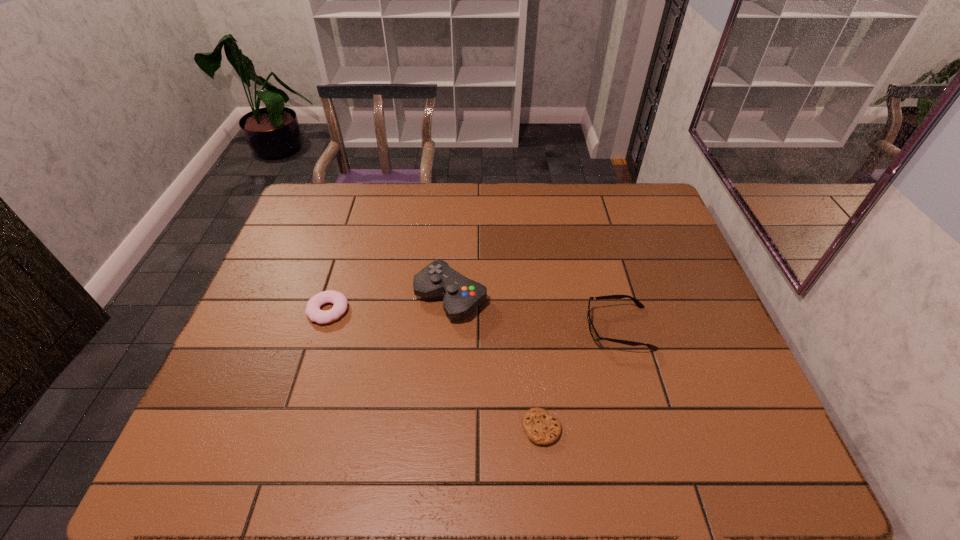
Where is `vacant area situated 0.220m on the front-facing side of the spectacles`? The width and height of the screenshot is (960, 540). vacant area situated 0.220m on the front-facing side of the spectacles is located at coordinates (502, 328).

In order to click on free location located on the front-facing side of the spectacles in this screenshot , I will do `click(464, 328)`.

Identify the location of blank space located on the front of the doughnut. (284, 451).

At what (x,y) coordinates should I click in order to perform the action: click on free space located 0.220m on the right of the second object from right to left. Please return your answer as a coordinate pair (x, y). This screenshot has height=540, width=960. Looking at the image, I should click on (661, 428).

You are a GUI agent. You are given a task and a screenshot of the screen. Output one action in this format:
    pyautogui.click(x=<x>, y=<y>)
    Task: Click on the object located at the near edge
    
    Given the screenshot: What is the action you would take?
    pyautogui.click(x=542, y=429)

The width and height of the screenshot is (960, 540). Identify the location of object that is positioned at the left edge. (340, 302).

Identify the location of free space at the far edge of the desktop. Image resolution: width=960 pixels, height=540 pixels. (391, 221).

In the image, there is a desktop. Find the location of `vacant space at the near edge`. vacant space at the near edge is located at coordinates (509, 448).

The image size is (960, 540). In the image, there is a desktop. What are the coordinates of `vacant area at the left edge` in the screenshot? It's located at (272, 323).

This screenshot has height=540, width=960. Identify the location of vacant area at the right edge. click(686, 276).